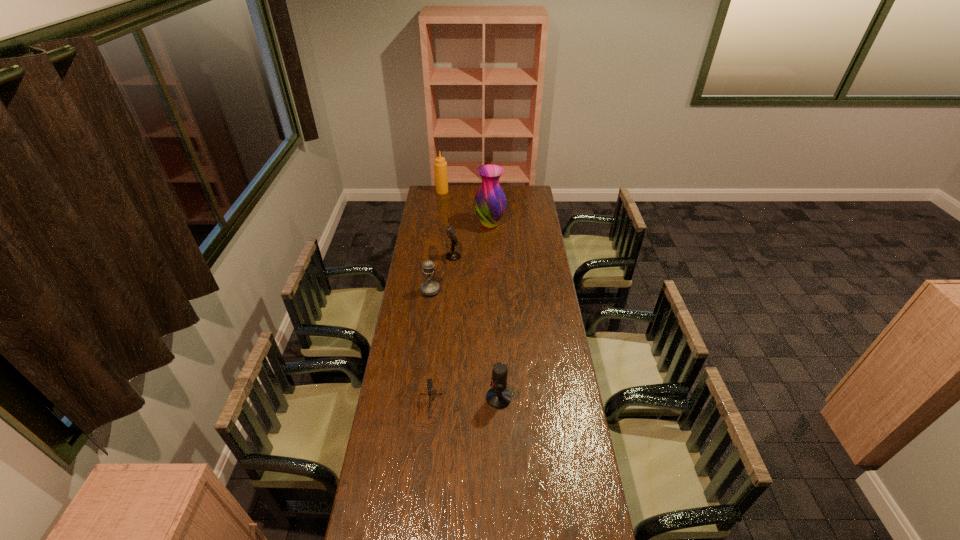
You are a GUI agent. You are given a task and a screenshot of the screen. Output one action in this format:
    pyautogui.click(x=<x>, y=<y>)
    Task: Click on the fifth nearest object
    
    Given the screenshot: What is the action you would take?
    pyautogui.click(x=490, y=201)

You are a GUI agent. You are given a task and a screenshot of the screen. Output one action in this format:
    pyautogui.click(x=<x>, y=<y>)
    Task: Click on the tallest object
    This screenshot has width=960, height=540.
    Given the screenshot: What is the action you would take?
    (x=490, y=201)

Where is `the fifth shortest object`? This screenshot has height=540, width=960. the fifth shortest object is located at coordinates (440, 165).

Find the location of `condiment`. condiment is located at coordinates pos(440,165).

The height and width of the screenshot is (540, 960). In order to click on the third farthest object in this screenshot , I will do `click(451, 256)`.

Find the location of a particular element. The height and width of the screenshot is (540, 960). the second farthest microphone is located at coordinates [429, 288].

This screenshot has height=540, width=960. In order to click on the rightmost microphone in this screenshot , I will do `click(498, 397)`.

At what (x,y) coordinates should I click in order to perform the action: click on the shortest microphone. Please return your answer as a coordinate pair (x, y). Looking at the image, I should click on (429, 381).

Locate an element on the screen. The image size is (960, 540). vacant position located 0.130m on the front of the tallest object is located at coordinates (491, 247).

This screenshot has width=960, height=540. I want to click on free space located 0.140m on the right of the farthest object, so click(x=469, y=191).